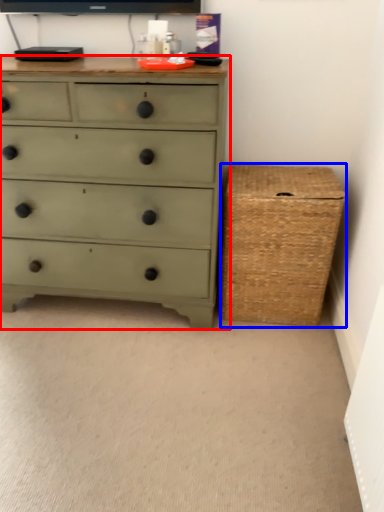
Question: Which of the following is the farthest to the observer, chest of drawers (highlighted by a red box) or basket (highlighted by a blue box)?

Choices:
 (A) chest of drawers
 (B) basket

Answer: (B)